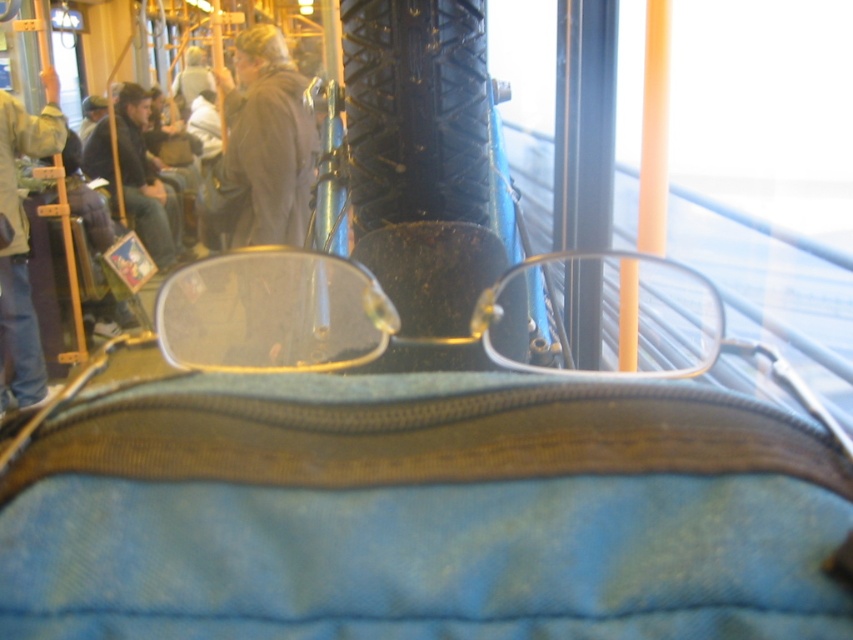
Question: Is clear plastic glasses at center above black rubber tire at center?

Choices:
 (A) no
 (B) yes

Answer: (A)

Question: Which point is closer to the camera?

Choices:
 (A) dark blue jeans at left
 (B) clear plastic glasses at center
 (C) dark gray jacket at center
 (D) black rubber tire at center

Answer: (B)

Question: Is blue fabric bag at center above dark gray jacket at center?

Choices:
 (A) yes
 (B) no

Answer: (B)

Question: Does clear plastic glasses at center appear on the left side of denim jacket at left?

Choices:
 (A) no
 (B) yes

Answer: (A)

Question: Which point appears farthest from the camera in this image?

Choices:
 (A) click(x=363, y=573)
 (B) click(x=175, y=228)
 (C) click(x=405, y=17)
 (D) click(x=15, y=240)

Answer: (B)

Question: Which of these objects is positioned farthest from the dark gray jacket at center?

Choices:
 (A) dark blue jeans at left
 (B) clear plastic glasses at center
 (C) denim jacket at left
 (D) black rubber tire at center

Answer: (D)